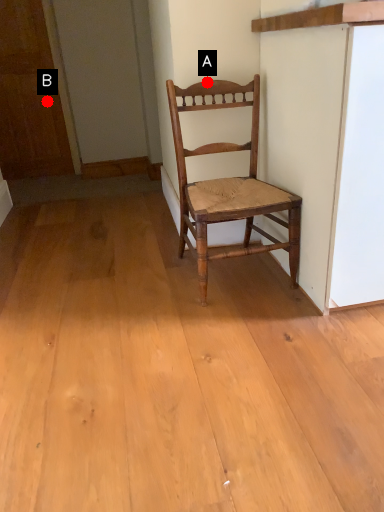
Question: Two points are circled on the image, labeled by A and B beside each circle. Among these points, which one is nearest to the camera?

Choices:
 (A) A is closer
 (B) B is closer

Answer: (A)